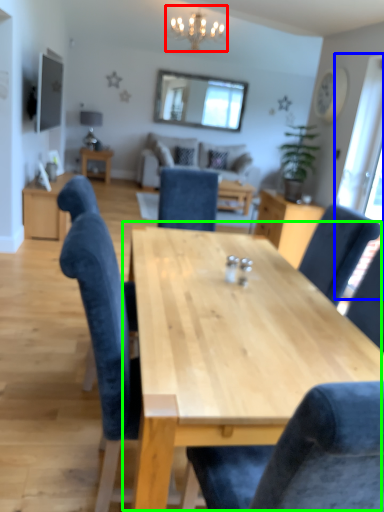
Question: Which object is the farthest from light fixture (highlighted by a red box)? Choose among these: window screen (highlighted by a blue box) or table (highlighted by a green box).

Choices:
 (A) window screen
 (B) table

Answer: (B)